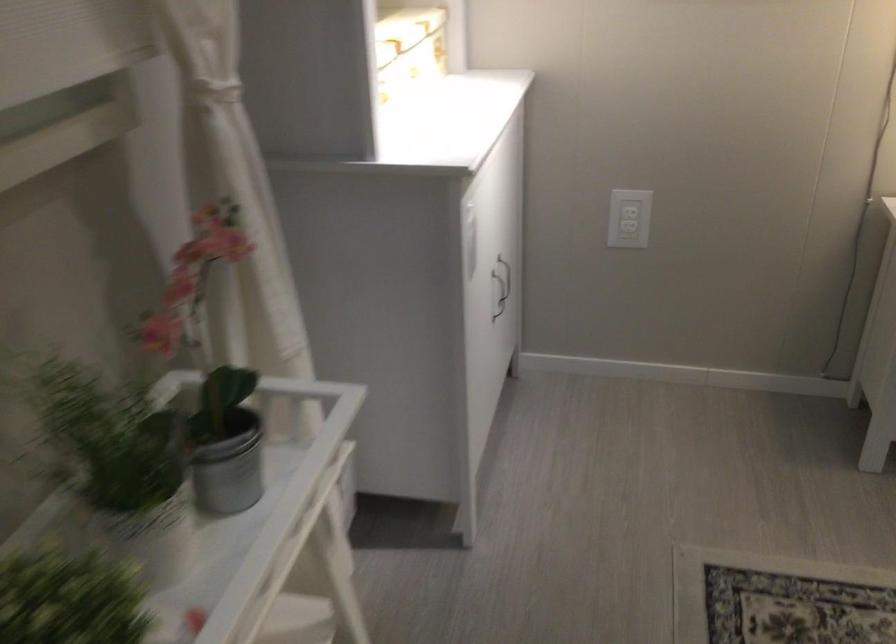
Find where to lift the metal plant pot. Please return your answer as a coordinate pair (x, y).

(227, 462)